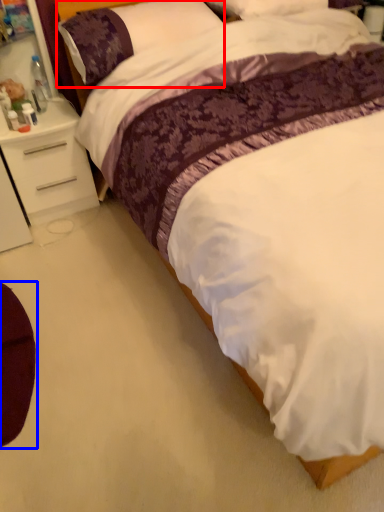
Question: Which object appears closest to the camera in this image, pillow (highlighted by a red box) or swivel chair (highlighted by a blue box)?

Choices:
 (A) pillow
 (B) swivel chair

Answer: (B)